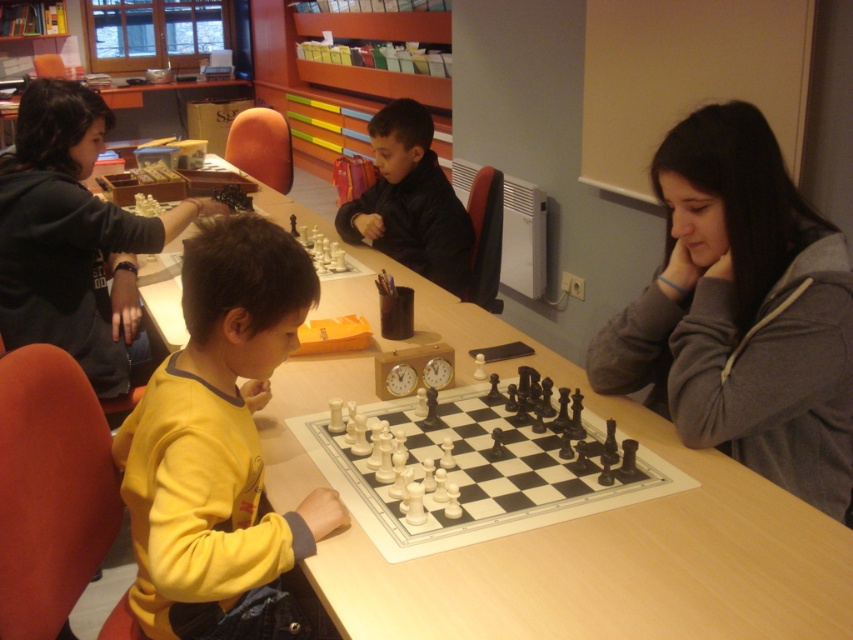
Question: Is wooden table at center below black plastic chess set at center?

Choices:
 (A) yes
 (B) no

Answer: (B)

Question: Among these points, which one is nearest to the camera?

Choices:
 (A) pos(409,268)
 (B) pos(677,365)
 (C) pos(196,307)
 (D) pos(450,524)

Answer: (C)

Question: Among these objects, which one is farthest from the camera?

Choices:
 (A) wooden table at center
 (B) black matte jacket at center
 (C) yellow fleece at center

Answer: (B)

Question: Is yellow fleece at center bigger than dark gray hoodie at left?

Choices:
 (A) yes
 (B) no

Answer: (B)

Question: Is wooden table at center closer to the viewer compared to gray fleece hoodie at center?

Choices:
 (A) no
 (B) yes

Answer: (B)

Question: Which is farther from the yellow fleece at center?

Choices:
 (A) black plastic chess set at center
 (B) dark gray hoodie at left
 (C) gray fleece hoodie at center
 (D) wooden table at center

Answer: (B)